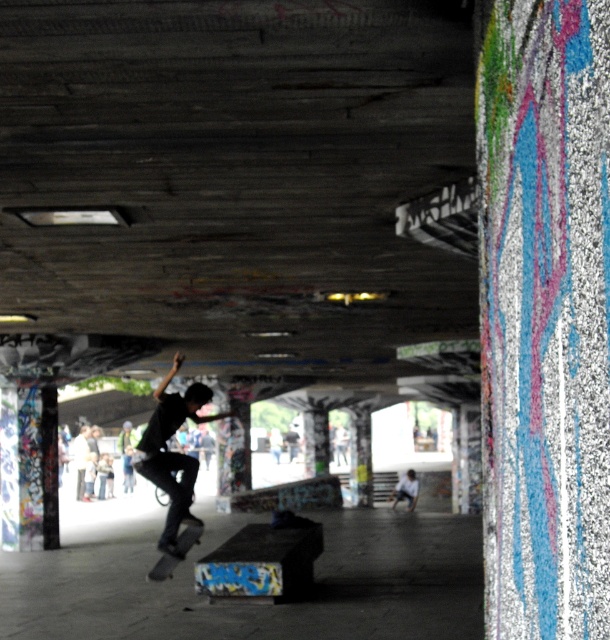
You are a photographer positioned at the skatepark. You want to capture the black matte skateboarder at center and the black matte skateboard at lower center in a single shot. Which object should you focus on first to ensure both are in frame?

The black matte skateboard at lower center should be focused on first since the skateboarder is above it, ensuring both will be captured in the frame.